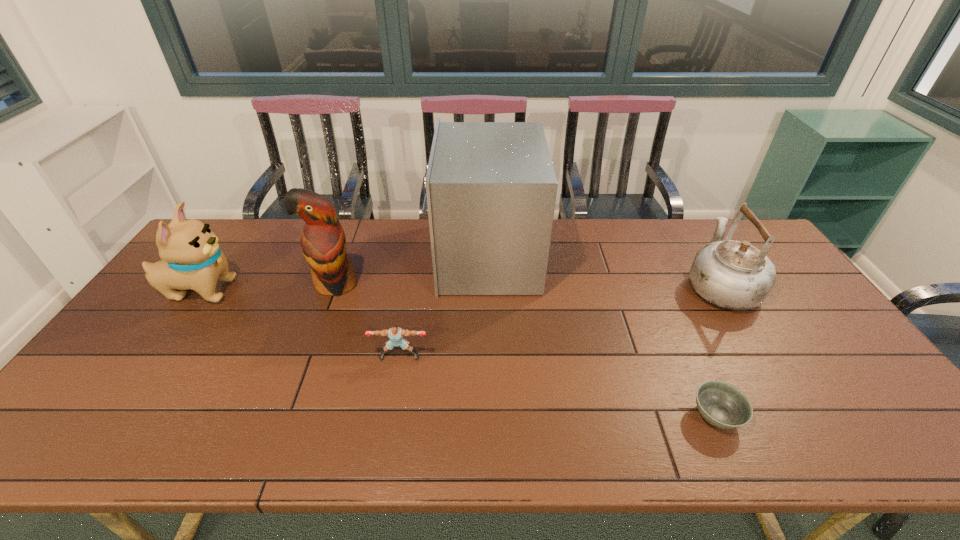
The height and width of the screenshot is (540, 960). Identify the location of free space that is in between the fifth object from left to right and the rightmost object. coord(718,350).

You are a GUI agent. You are given a task and a screenshot of the screen. Output one action in this format:
    pyautogui.click(x=<x>, y=<y>)
    Task: Click on the unoccupied area between the bowl and the rightmost object
    The width and height of the screenshot is (960, 540).
    Given the screenshot: What is the action you would take?
    pyautogui.click(x=718, y=350)

I want to click on vacant space that is in between the toaster oven and the kettle, so click(603, 271).

Find the location of a particular element. Image resolution: width=960 pixels, height=540 pixels. free spot between the nearest object and the kettle is located at coordinates (718, 350).

Locate an element on the screen. This screenshot has width=960, height=540. empty space that is in between the kettle and the nearest object is located at coordinates point(718,350).

This screenshot has width=960, height=540. I want to click on vacant area that lies between the second object from left to right and the toaster oven, so click(410, 271).

The width and height of the screenshot is (960, 540). What are the coordinates of `object that stands as the closest to the fifth object from right to left` in the screenshot? It's located at (395, 333).

This screenshot has width=960, height=540. In order to click on the fifth closest object to the parrot in this screenshot , I will do `click(733, 275)`.

You are a GUI agent. You are given a task and a screenshot of the screen. Output one action in this format:
    pyautogui.click(x=<x>, y=<y>)
    Task: Click on the free space that satisfies the following two spatial constraints: 1. on the face of the parrot; 2. on the face of the puppy
    This screenshot has width=960, height=540.
    Given the screenshot: What is the action you would take?
    pyautogui.click(x=333, y=291)

At what (x,y) coordinates should I click in order to perform the action: click on free point that satisfies the following two spatial constraints: 1. on the face of the leftmost object; 2. on the right side of the nearest object. Please return your answer as a coordinate pair (x, y). The width and height of the screenshot is (960, 540). Looking at the image, I should click on (110, 416).